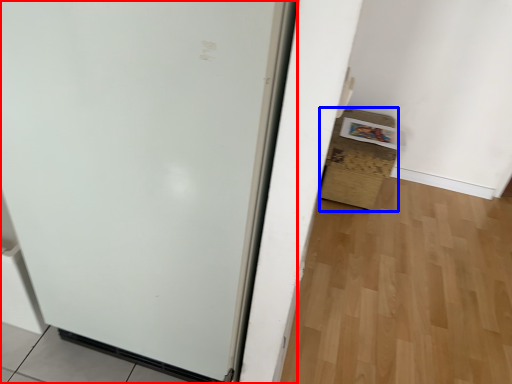
Question: Which object appears farthest to the camera in this image, door (highlighted by a red box) or cardboard box (highlighted by a blue box)?

Choices:
 (A) door
 (B) cardboard box

Answer: (B)